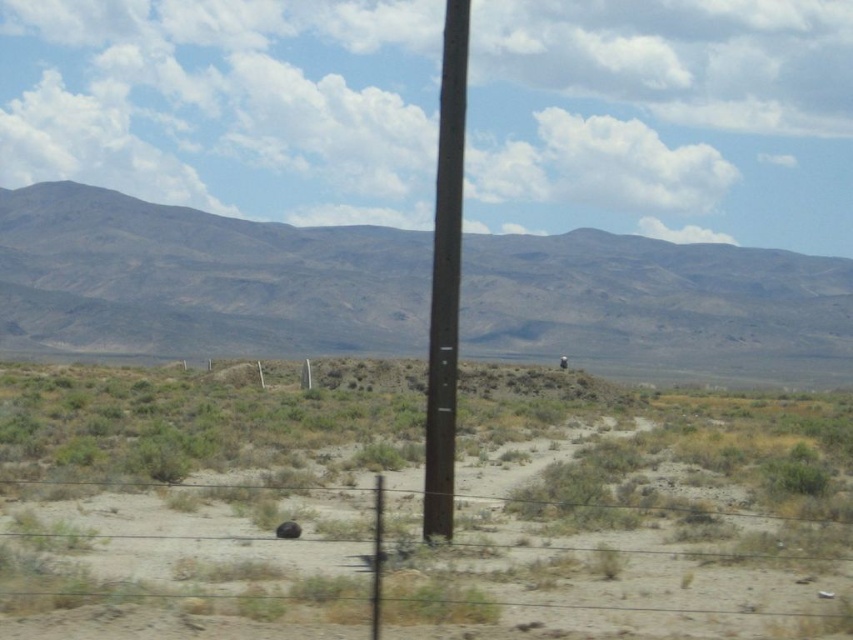
Question: Does gray/desert-textured mountain at upper center have a greater width compared to brown wooden pole at center?

Choices:
 (A) no
 (B) yes

Answer: (B)

Question: Considering the relative positions of gray/desert-textured mountain at upper center and brown wooden pole at center in the image provided, where is gray/desert-textured mountain at upper center located with respect to brown wooden pole at center?

Choices:
 (A) right
 (B) left

Answer: (A)

Question: Which object appears farthest from the camera in this image?

Choices:
 (A) gray/desert-textured mountain at upper center
 (B) brown sandy dirt at center

Answer: (A)

Question: Based on their relative distances, which object is nearer to the brown sandy dirt at center?

Choices:
 (A) gray/desert-textured mountain at upper center
 (B) brown wooden pole at center

Answer: (B)

Question: Is the position of brown sandy dirt at center less distant than that of brown wooden pole at center?

Choices:
 (A) yes
 (B) no

Answer: (A)

Question: Which point is closer to the camera taking this photo?

Choices:
 (A) [299, 616]
 (B) [445, 124]
 (C) [59, 300]

Answer: (A)